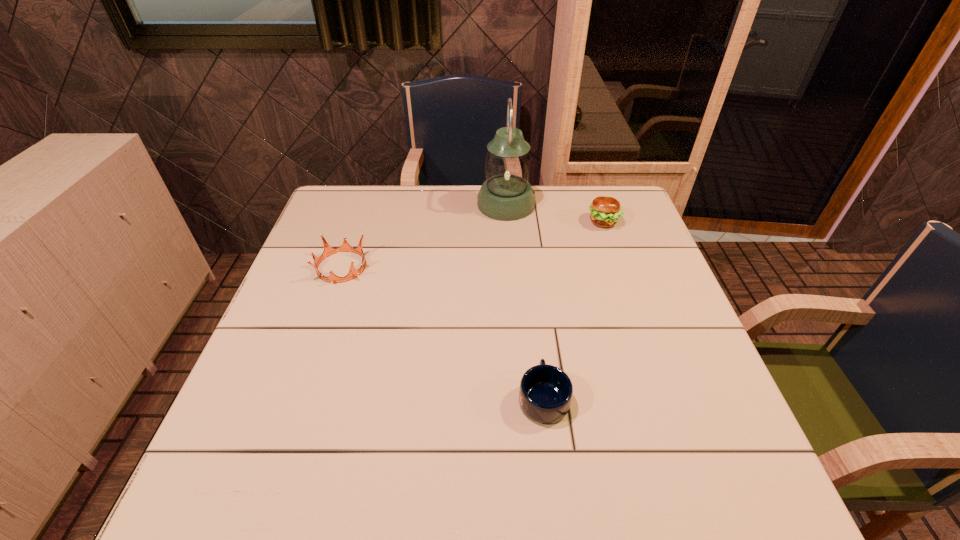
Locate an element on the screen. lantern is located at coordinates click(x=506, y=195).

You are a GUI agent. You are given a task and a screenshot of the screen. Output one action in this format:
    pyautogui.click(x=<x>, y=<y>)
    Task: Click on the hamburger
    This screenshot has width=960, height=540.
    Given the screenshot: What is the action you would take?
    pyautogui.click(x=605, y=211)

Locate an element on the screen. Image resolution: width=960 pixels, height=540 pixels. the third shortest object is located at coordinates (605, 211).

Identify the location of the second nearest object. (345, 247).

Locate an element on the screen. Image resolution: width=960 pixels, height=540 pixels. crown is located at coordinates (345, 247).

This screenshot has width=960, height=540. I want to click on mug, so click(545, 393).

This screenshot has height=540, width=960. Identify the location of vacant point located on the left of the tallest object. (427, 204).

The image size is (960, 540). Identify the location of vacant point located on the left of the third shortest object. (498, 222).

The width and height of the screenshot is (960, 540). I want to click on vacant space located on the right of the third farthest object, so point(453,267).

Where is `free space located 0.350m with the handle on the side of the mug`? The width and height of the screenshot is (960, 540). free space located 0.350m with the handle on the side of the mug is located at coordinates (527, 265).